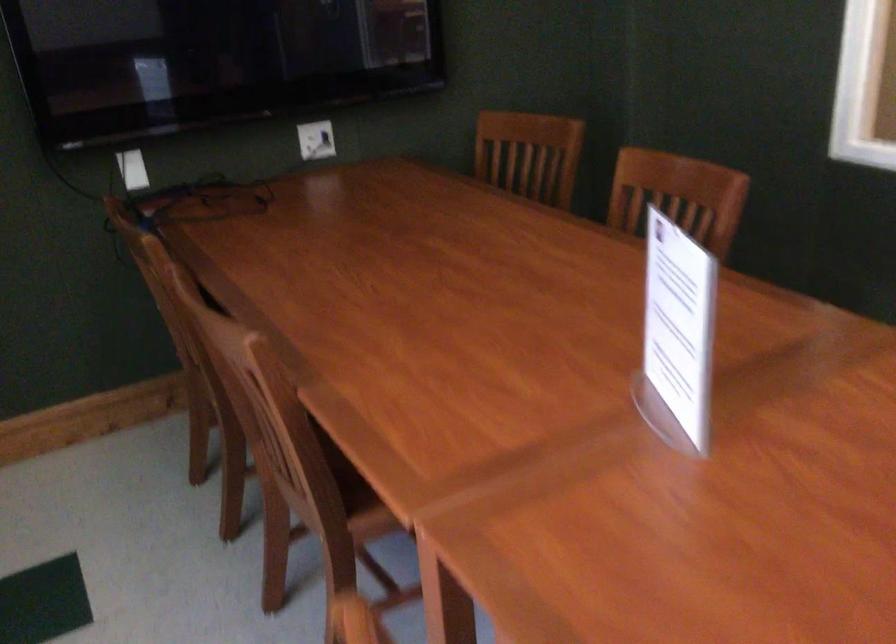
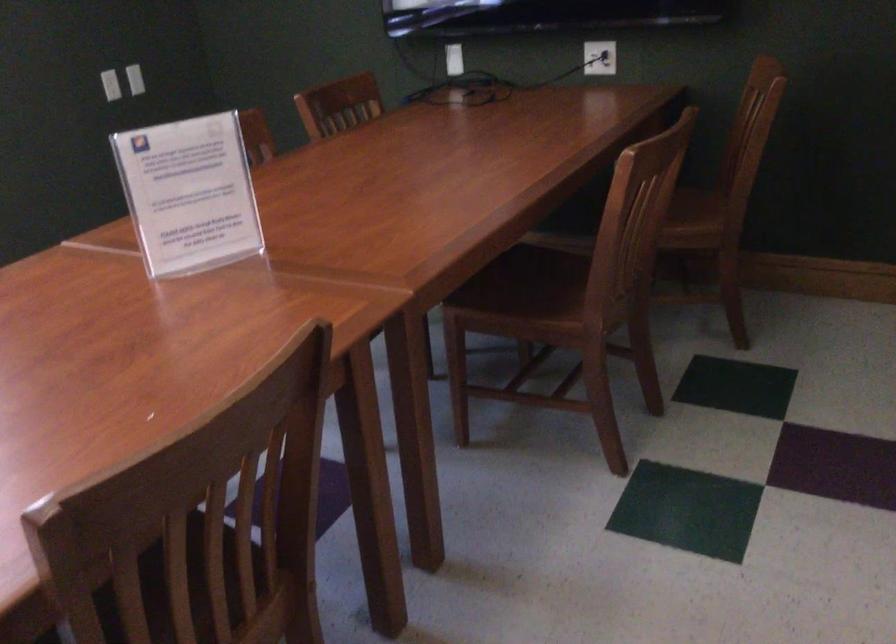
Locate, in the second image, the point that corresponds to point (653, 322) in the first image.

(188, 194)